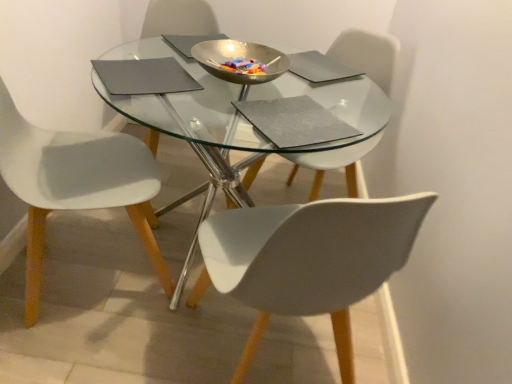
Question: Is transparent glass table at center looking in the opposite direction of white plastic chair at lower right, which is the second chair in right-to-left order?

Choices:
 (A) no
 (B) yes

Answer: (A)

Question: Considering the relative positions of transparent glass table at center and white plastic chair at lower right, which is the second chair in right-to-left order, in the image provided, is transparent glass table at center to the left of white plastic chair at lower right, which is the second chair in right-to-left order, from the viewer's perspective?

Choices:
 (A) no
 (B) yes

Answer: (B)

Question: From the image's perspective, is transparent glass table at center on top of white plastic chair at lower right, which is the second chair in right-to-left order?

Choices:
 (A) yes
 (B) no

Answer: (A)

Question: Is transparent glass table at center taller than white plastic chair at lower right, the 2th chair viewed from the left?

Choices:
 (A) yes
 (B) no

Answer: (B)

Question: Considering the relative sizes of transparent glass table at center and white plastic chair at lower right, which is the second chair in right-to-left order, in the image provided, is transparent glass table at center thinner than white plastic chair at lower right, which is the second chair in right-to-left order,?

Choices:
 (A) no
 (B) yes

Answer: (A)

Question: Is transparent glass table at center at the right side of white plastic chair at lower right, the 2th chair viewed from the left?

Choices:
 (A) yes
 (B) no

Answer: (B)

Question: Is white matte chair at lower left, the 3th chair positioned from the right, next to transparent glass table at center?

Choices:
 (A) yes
 (B) no

Answer: (B)

Question: Considering the relative sizes of white matte chair at lower left, the 3th chair positioned from the right, and transparent glass table at center in the image provided, is white matte chair at lower left, the 3th chair positioned from the right, wider than transparent glass table at center?

Choices:
 (A) yes
 (B) no

Answer: (B)

Question: Can you confirm if white matte chair at lower left, the 3th chair positioned from the right, is positioned to the left of transparent glass table at center?

Choices:
 (A) no
 (B) yes

Answer: (B)

Question: Is white matte chair at lower left, the 3th chair positioned from the right, completely or partially outside of transparent glass table at center?

Choices:
 (A) yes
 (B) no

Answer: (B)

Question: Is white matte chair at lower left, which is the first chair from left to right, smaller than transparent glass table at center?

Choices:
 (A) no
 (B) yes

Answer: (B)

Question: Is white matte chair at lower left, which is the first chair from left to right, bigger than transparent glass table at center?

Choices:
 (A) no
 (B) yes

Answer: (A)

Question: Is metallic gold bowl at center taller than transparent glass table at center?

Choices:
 (A) yes
 (B) no

Answer: (B)